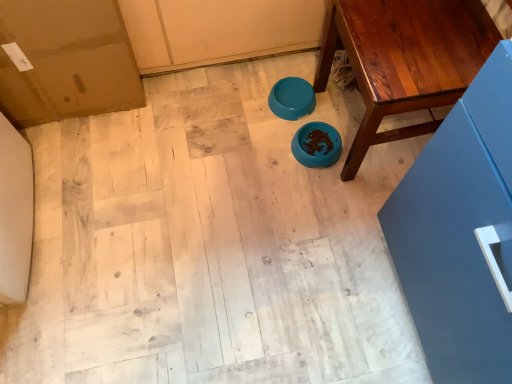
Image resolution: width=512 pixels, height=384 pixels. In order to click on unoccupied space behind teal glossy bowl at center, the first bowl when ordered from top to bottom in this screenshot , I will do `click(281, 62)`.